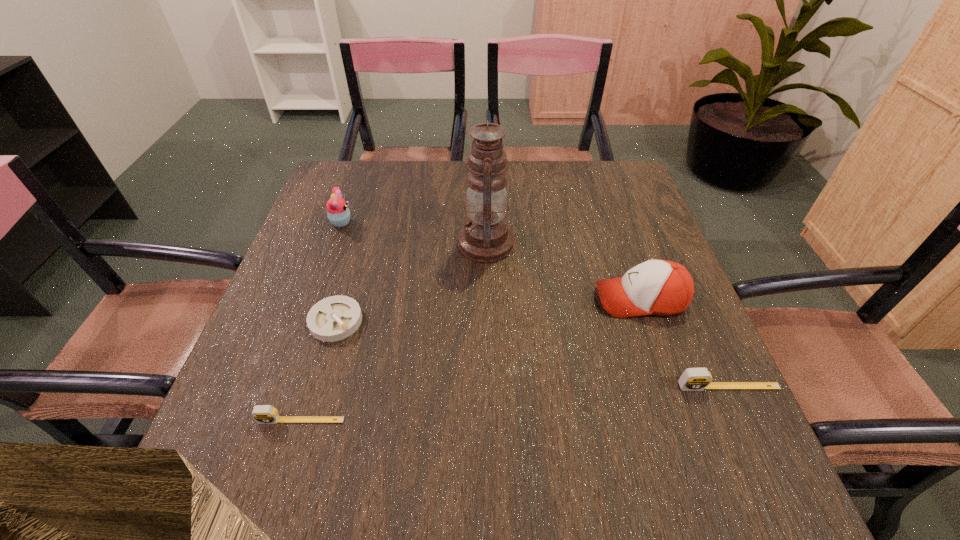
Locate an element on the screen. blank space at the near right corner of the desktop is located at coordinates (678, 420).

Image resolution: width=960 pixels, height=540 pixels. What are the coordinates of `free space between the left tape measure and the ashtray` in the screenshot? It's located at (319, 370).

Identify the location of free space between the oil lamp and the cupcake. The height and width of the screenshot is (540, 960). pos(414,233).

This screenshot has height=540, width=960. In order to click on blank region between the cupcake and the shortest object in this screenshot , I will do `click(339, 272)`.

You are a GUI agent. You are given a task and a screenshot of the screen. Output one action in this format:
    pyautogui.click(x=<x>, y=<y>)
    Task: Click on the blank region between the second shortest object and the ashtray
    
    Given the screenshot: What is the action you would take?
    pyautogui.click(x=319, y=370)

The width and height of the screenshot is (960, 540). Identify the location of blank region between the ashtray and the fourth object from left to right. (411, 282).

Image resolution: width=960 pixels, height=540 pixels. Find the location of `unoccupied area between the cupcake and the ashtray`. unoccupied area between the cupcake and the ashtray is located at coordinates (339, 272).

You are a GUI agent. You are given a task and a screenshot of the screen. Output one action in this format:
    pyautogui.click(x=<x>, y=<y>)
    Task: Click on the vacant space that is in between the baseball cap and the tallest object
    This screenshot has width=960, height=540.
    Given the screenshot: What is the action you would take?
    pyautogui.click(x=564, y=271)

Locate an element on the screen. This screenshot has height=540, width=960. free space that is in between the nearer tape measure and the baseball cap is located at coordinates (470, 360).

The height and width of the screenshot is (540, 960). I want to click on vacant space in between the cupcake and the third object from right to left, so click(x=414, y=233).